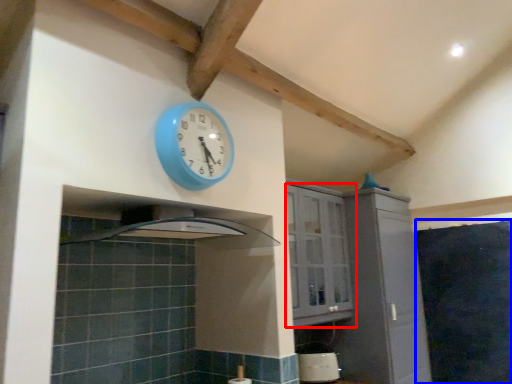
Question: Which of the following is the farthest to the observer, cabinetry (highlighted by a red box) or dark (highlighted by a blue box)?

Choices:
 (A) cabinetry
 (B) dark

Answer: (B)